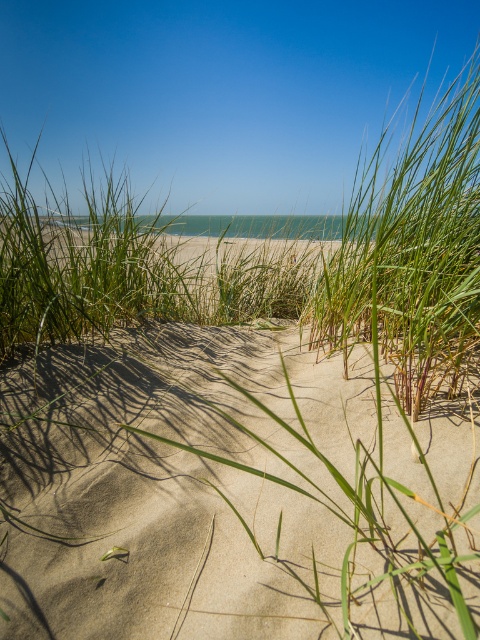
Question: Which of the following is the closest to the observer?

Choices:
 (A) green grass at center
 (B) sandy beige sand at center

Answer: (B)

Question: Can you confirm if sandy beige sand at center is bigger than green grass at center?

Choices:
 (A) no
 (B) yes

Answer: (A)

Question: Does sandy beige sand at center appear on the right side of green grass at center?

Choices:
 (A) yes
 (B) no

Answer: (B)

Question: In this image, where is sandy beige sand at center located relative to green grass at center?

Choices:
 (A) left
 (B) right

Answer: (A)